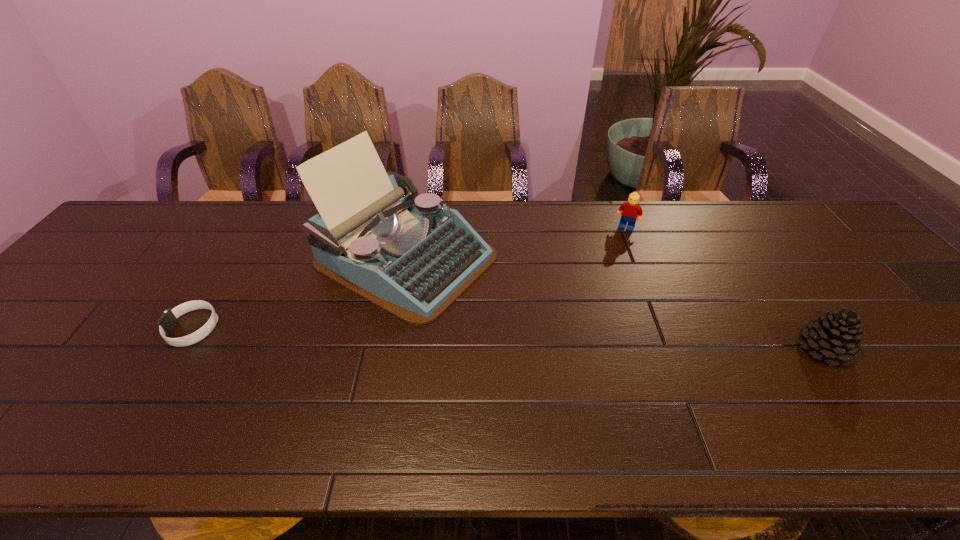
The height and width of the screenshot is (540, 960). I want to click on free spot between the second object from right to left and the rightmost object, so click(x=725, y=288).

Locate an element on the screen. The height and width of the screenshot is (540, 960). free space between the Lego and the pinecone is located at coordinates (725, 288).

Identify which object is located as the second nearest to the rightmost object. Please provide its 2D coordinates. Your answer should be formatted as a tuple, i.e. [(x, y)], where the tuple contains the x and y coordinates of a point satisfying the conditions above.

[(374, 235)]

You are a GUI agent. You are given a task and a screenshot of the screen. Output one action in this format:
    pyautogui.click(x=<x>, y=<y>)
    Task: Click on the object that is the second closest to the wristband
    The image size is (960, 540).
    Given the screenshot: What is the action you would take?
    pyautogui.click(x=631, y=211)